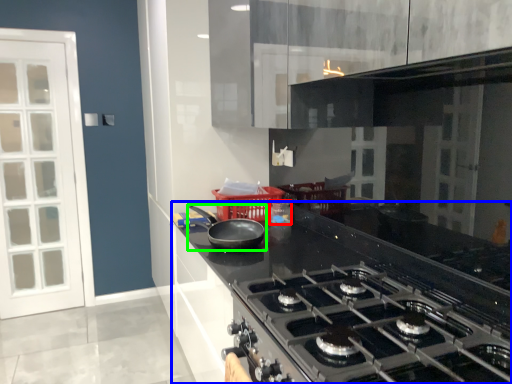
Question: Considering the real-world distances, which object is farthest from appliance (highlighted by a red box)? countertop (highlighted by a blue box) or kitchen appliance (highlighted by a green box)?

Choices:
 (A) countertop
 (B) kitchen appliance

Answer: (A)